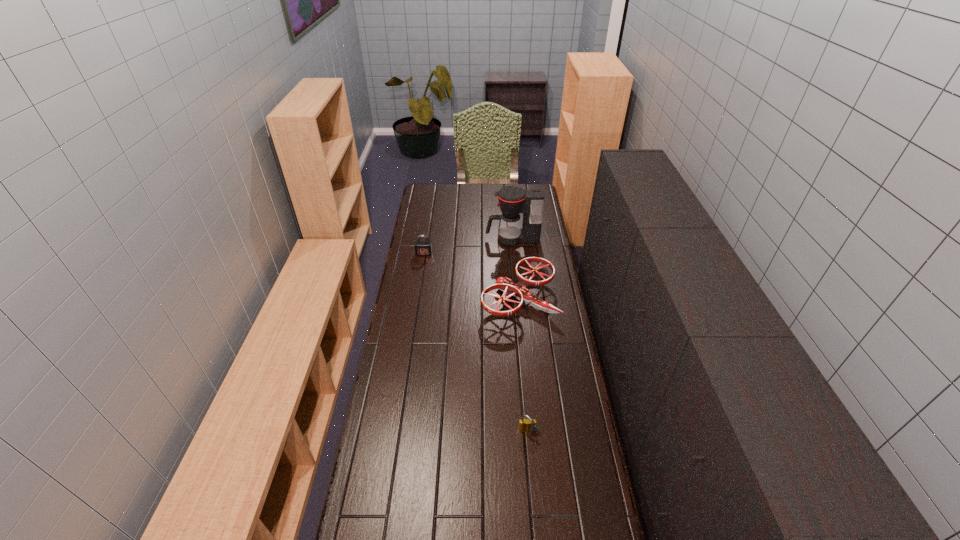
Locate an element on the screen. This screenshot has width=960, height=540. the farthest object is located at coordinates (512, 200).

Where is `coffee maker`? Image resolution: width=960 pixels, height=540 pixels. coffee maker is located at coordinates pyautogui.click(x=512, y=200).

At what (x,y) coordinates should I click in order to perform the action: click on the farther padlock. Please return your answer as a coordinate pair (x, y). This screenshot has width=960, height=540. Looking at the image, I should click on (422, 248).

At what (x,y) coordinates should I click in order to perform the action: click on the leftmost object. Please return your answer as a coordinate pair (x, y). The width and height of the screenshot is (960, 540). Looking at the image, I should click on (422, 248).

Identify the location of drone. click(519, 291).

At what (x,y) coordinates should I click in order to perform the action: click on the nearest object. Please return your answer as a coordinate pair (x, y). The width and height of the screenshot is (960, 540). Looking at the image, I should click on (526, 425).

Locate an element on the screen. The image size is (960, 540). the nearer padlock is located at coordinates (526, 425).

This screenshot has height=540, width=960. I want to click on blank area located pour from the carafe of the tallest object, so click(x=441, y=239).

The height and width of the screenshot is (540, 960). I want to click on free point located pour from the carafe of the tallest object, so click(x=443, y=239).

I want to click on free space located pour from the carafe of the tallest object, so click(x=454, y=239).